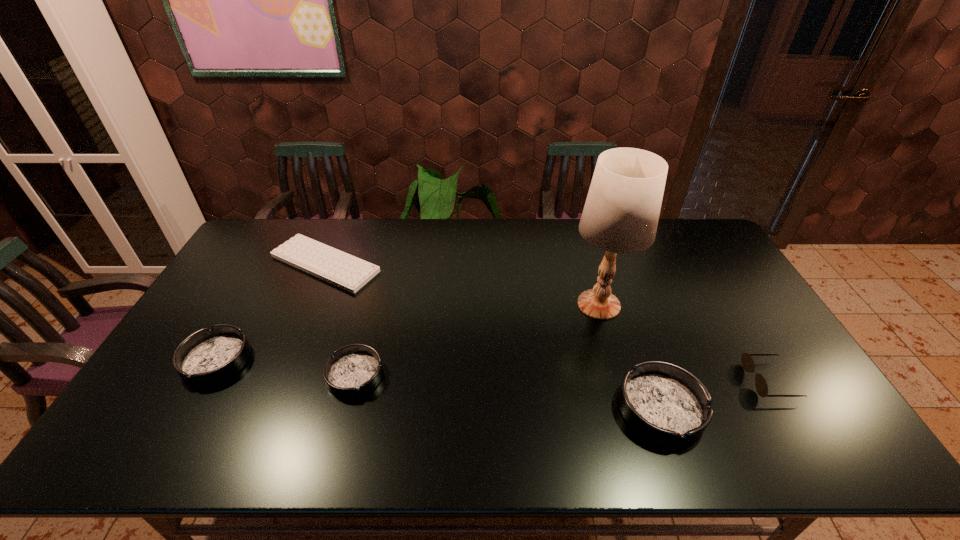
Where is `the leftmost ashtray`? The image size is (960, 540). the leftmost ashtray is located at coordinates (207, 357).

Locate an element on the screen. Image resolution: width=960 pixels, height=540 pixels. the shortest ashtray is located at coordinates (354, 370).

Where is `the second ashtray from left to right`? This screenshot has width=960, height=540. the second ashtray from left to right is located at coordinates coord(354,370).

Identify the location of the rightmost ashtray. This screenshot has width=960, height=540. (666, 404).

At what (x,y) coordinates should I click in order to perform the action: click on the shortest object. Please return your answer as a coordinate pair (x, y). This screenshot has width=960, height=540. Looking at the image, I should click on (348, 272).

I want to click on sunglasses, so click(747, 362).

Find the location of a particular element. the tallest object is located at coordinates (621, 213).

This screenshot has width=960, height=540. I want to click on blank area located 0.190m on the back of the second shortest ashtray, so click(x=255, y=291).

I want to click on vacant position located 0.290m on the right of the second ashtray from right to left, so click(492, 375).

Image resolution: width=960 pixels, height=540 pixels. Identify the location of vacant space situated on the right of the rightmost ashtray. (759, 409).